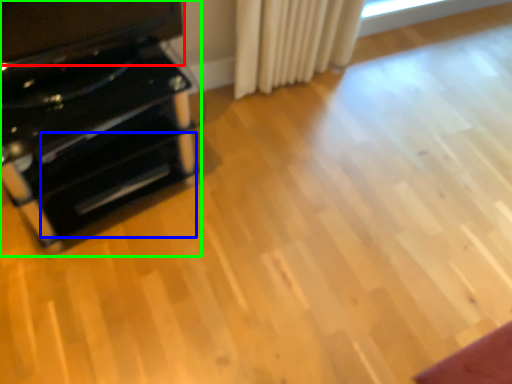
Question: Which object is the farthest from wide (highlighted by a red box)? Choose among these: drawer (highlighted by a blue box) or furniture (highlighted by a green box).

Choices:
 (A) drawer
 (B) furniture

Answer: (A)